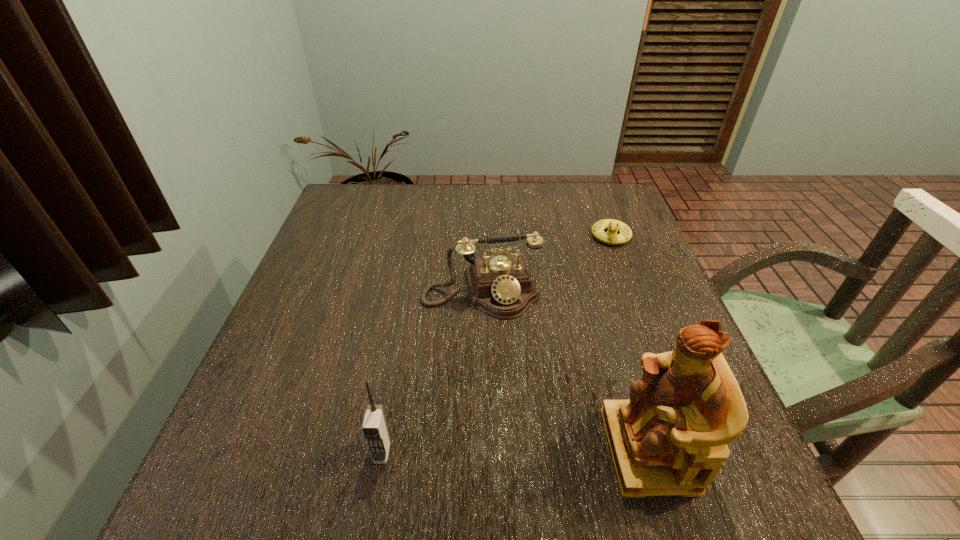
I want to click on object that is at the far right corner, so click(611, 237).

Locate an element on the screen. This screenshot has width=960, height=540. object present at the near right corner is located at coordinates (670, 438).

I want to click on vacant region at the far edge of the desktop, so click(x=577, y=222).

In the image, there is a desktop. Identify the location of free space at the near edge. (429, 428).

The width and height of the screenshot is (960, 540). In the image, there is a desktop. What are the coordinates of `vacant space at the left edge` in the screenshot? It's located at (359, 239).

Locate an element on the screen. The height and width of the screenshot is (540, 960). free space at the right edge is located at coordinates (x=660, y=327).

In the image, there is a desktop. At what (x,y) coordinates should I click in order to perform the action: click on vacant space at the far left corner. Please return your answer as a coordinate pair (x, y). Looking at the image, I should click on (366, 215).

The width and height of the screenshot is (960, 540). Identify the location of free space at the near left corner of the desktop. (309, 413).

The width and height of the screenshot is (960, 540). Find the location of `vacant space at the far right corner of the desktop`. vacant space at the far right corner of the desktop is located at coordinates (585, 202).

Locate an element on the screen. free space between the cellular telephone and the farthest object is located at coordinates (496, 344).